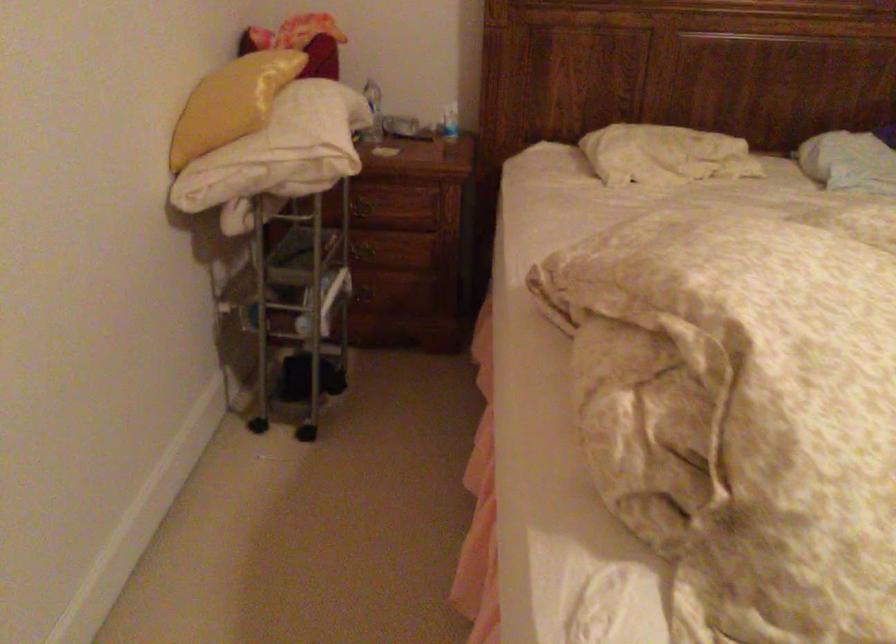
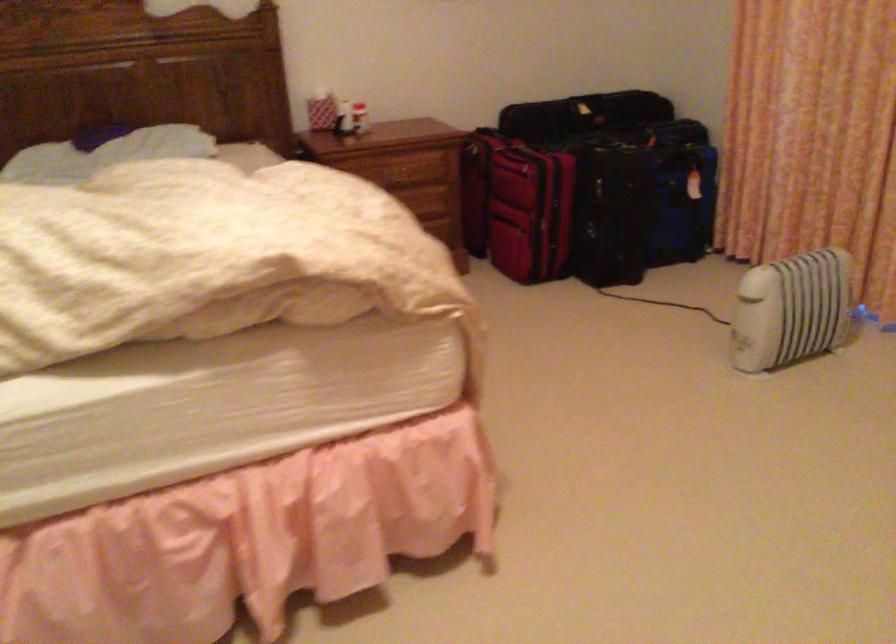
The images are taken continuously from a first-person perspective. In which direction are you moving?

The cameraman moved toward right, backward.